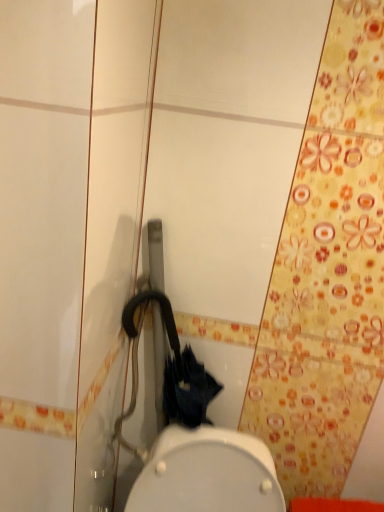
The width and height of the screenshot is (384, 512). Describe the element at coordinates (194, 439) in the screenshot. I see `black rubber umbrella at center` at that location.

The width and height of the screenshot is (384, 512). Find the location of `black rubber umbrella at center`. black rubber umbrella at center is located at coordinates (194, 439).

Find the location of a particular element. black rubber umbrella at center is located at coordinates (194, 439).